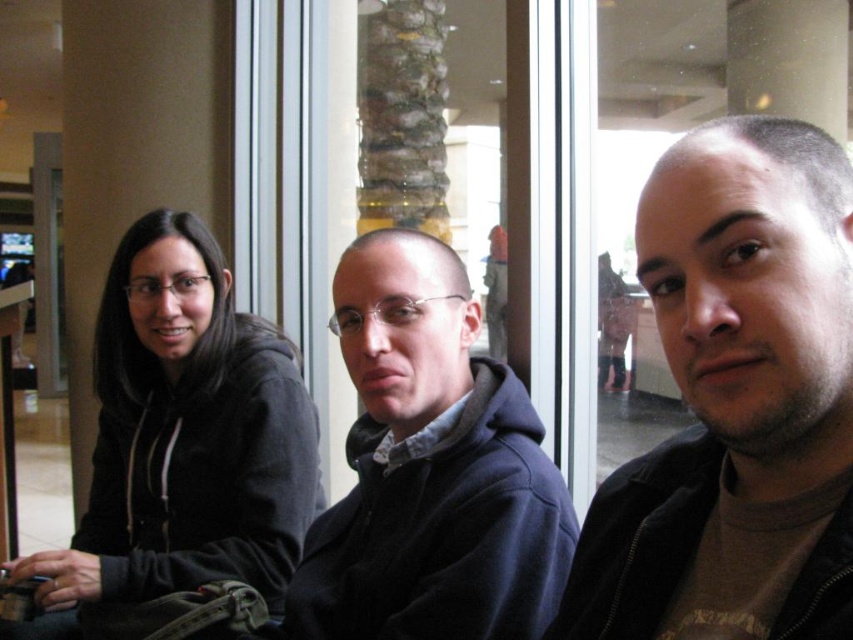
Question: Which point appears farthest from the camera in this image?

Choices:
 (A) (798, 195)
 (B) (157, 356)

Answer: (B)

Question: Which point is closer to the camera?

Choices:
 (A) black hoodie at left
 (B) dark brown leather jacket at center
 (C) dark blue hoodie at center

Answer: (B)

Question: Can you confirm if dark blue hoodie at center is wider than black hoodie at left?

Choices:
 (A) no
 (B) yes

Answer: (A)

Question: Does dark brown leather jacket at center lie behind dark blue hoodie at center?

Choices:
 (A) no
 (B) yes

Answer: (A)

Question: Can you confirm if dark brown leather jacket at center is bigger than black hoodie at left?

Choices:
 (A) no
 (B) yes

Answer: (A)

Question: Which of these objects is positioned closest to the dark blue hoodie at center?

Choices:
 (A) black hoodie at left
 (B) dark brown leather jacket at center

Answer: (B)